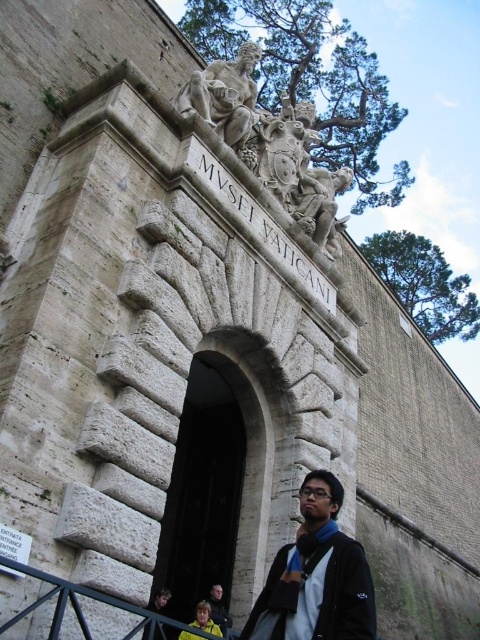
You are standing at the entrance of the Vatican Museums and see the white stone sculpture at upper center and the dark blue shirt at center. Which object is positioned higher in the scene?

The white stone sculpture at upper center is located above the dark blue shirt at center, so it is positioned higher in the scene.